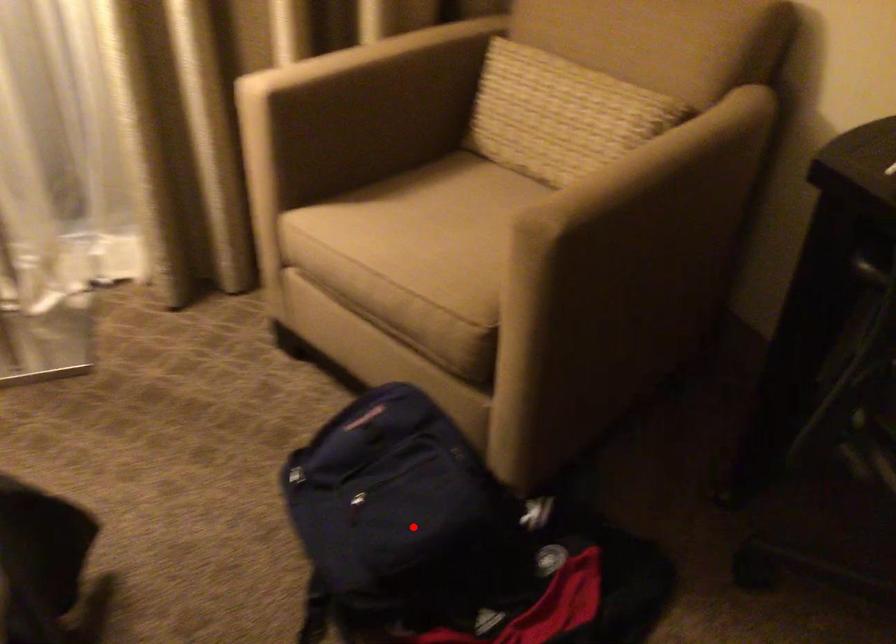
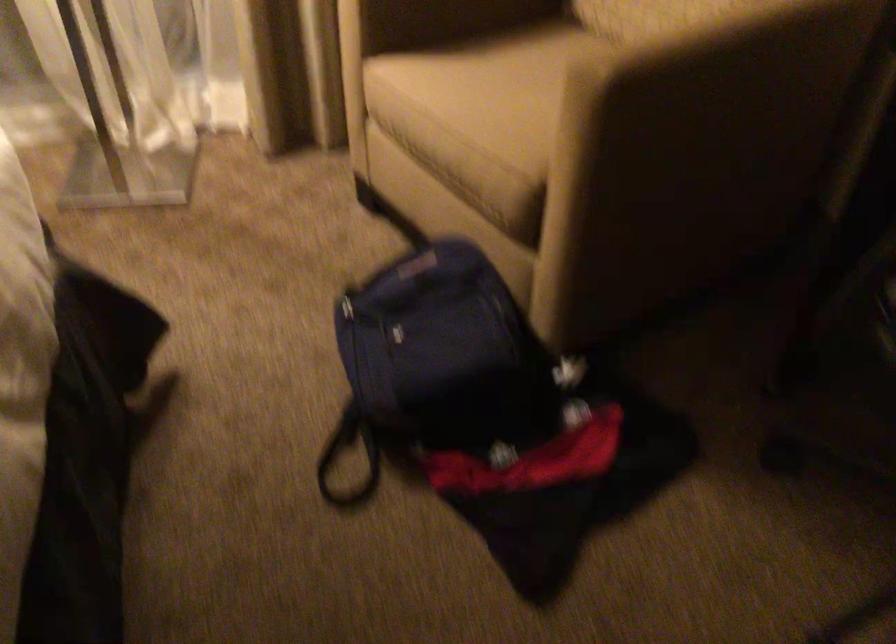
The point at the highlighted location is marked in the first image. Where is the corresponding point in the second image?

(442, 366)